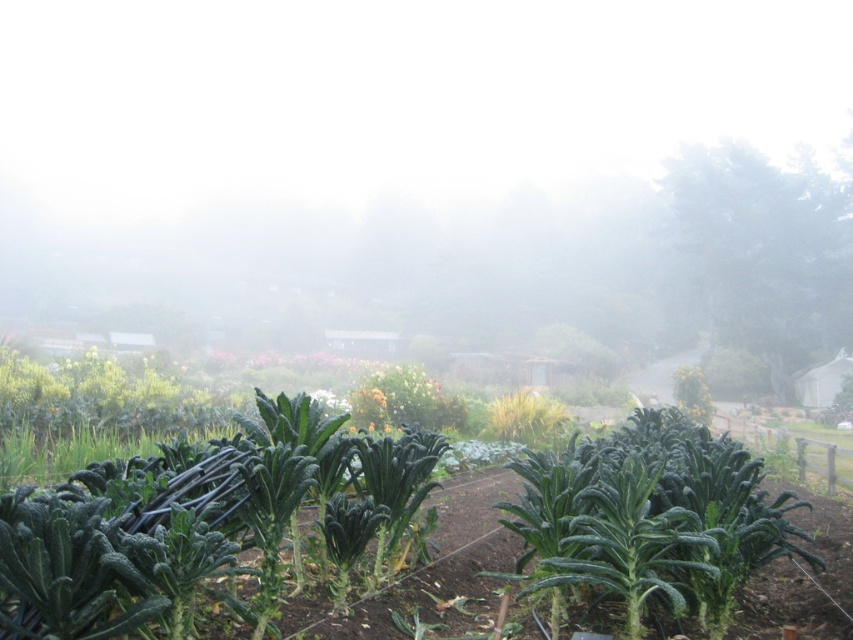
Can you confirm if white misty fog at upper center is thinner than green leafy vegetables at center?

In fact, white misty fog at upper center might be wider than green leafy vegetables at center.

Who is shorter, white misty fog at upper center or green leafy vegetables at center?

Standing shorter between the two is green leafy vegetables at center.

Who is more forward, [463,324] or [115,522]?

Point [115,522] is in front.

Find the location of `white misty fog at upper center`. white misty fog at upper center is located at coordinates (386, 150).